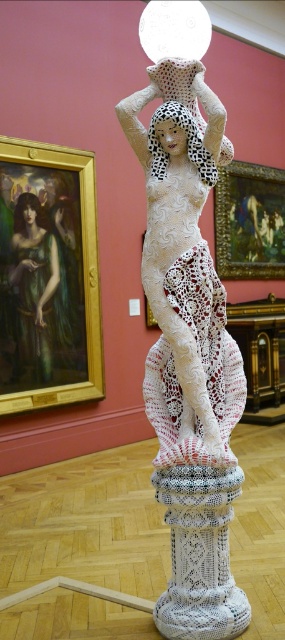
Question: Can you confirm if white crocheted doll at center is smaller than smooth black hair at upper left?

Choices:
 (A) yes
 (B) no

Answer: (B)

Question: Does white knitted pillar at center have a smaller size compared to dalmatian-patterned fabric head at center?

Choices:
 (A) no
 (B) yes

Answer: (A)

Question: Which object appears closest to the camera in this image?

Choices:
 (A) dalmatian-patterned fabric head at center
 (B) green glossy dress at upper left

Answer: (A)

Question: Which point is closer to the camera?

Choices:
 (A) white crochet dress at center
 (B) green glossy dress at upper left
 (C) smooth black hair at upper left

Answer: (A)

Question: Which object is farther from the camera taking this photo?

Choices:
 (A) white crocheted doll at center
 (B) smooth black hair at upper left

Answer: (B)

Question: Is white crocheted doll at center closer to the viewer compared to white crochet dress at center?

Choices:
 (A) yes
 (B) no

Answer: (A)